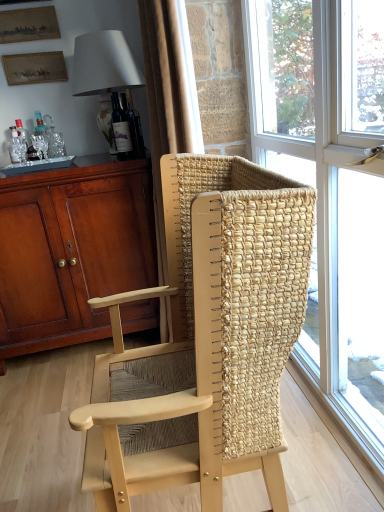
At what (x,y) coordinates should I click in order to perform the action: click on free spot to the right of matte glass bottle at upper center. Please return your answer as a coordinate pair (x, y). The width and height of the screenshot is (384, 512). Looking at the image, I should click on (140, 156).